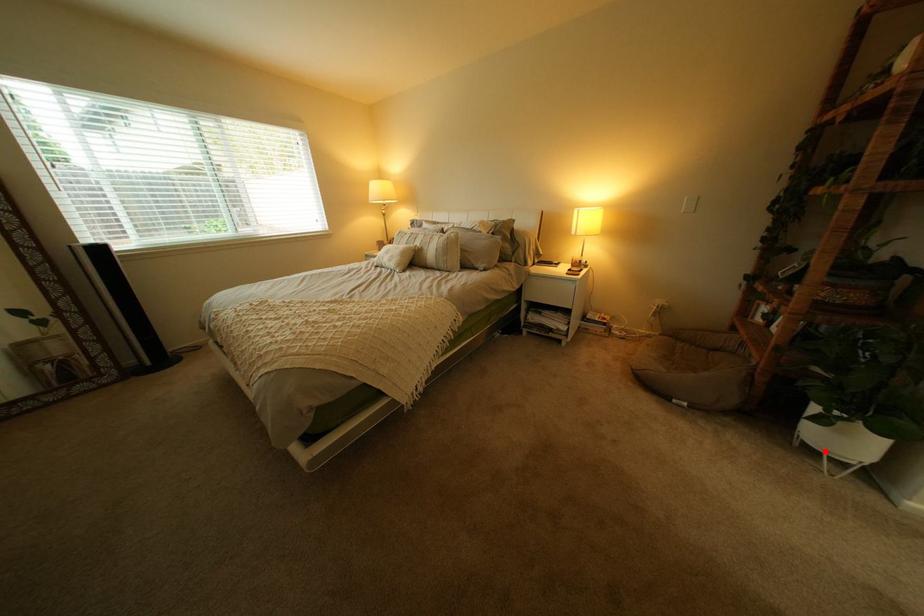
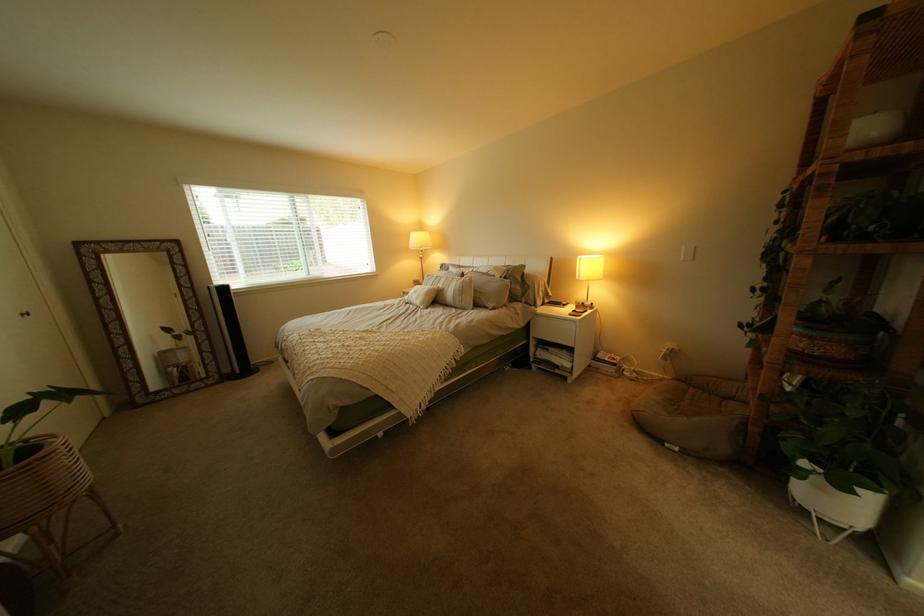
Question: I am providing you with two images of the same scene from different viewpoints. Given a red point in image1, look at the same physical point in image2. Is it:

Choices:
 (A) Closer to the viewpoint
 (B) Farther from the viewpoint

Answer: (B)